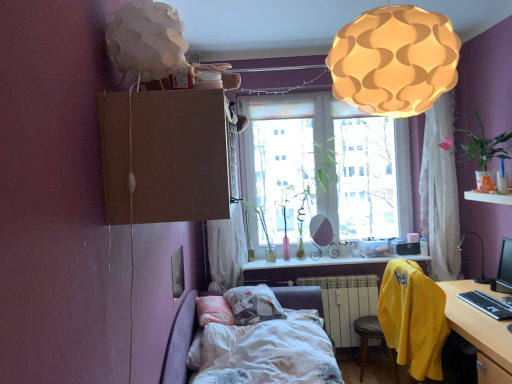
Question: Does white cotton bed at center come behind white sheer curtain at upper right, which appears as the 1th curtain when viewed from the right?

Choices:
 (A) yes
 (B) no

Answer: (B)

Question: Does white cotton bed at center turn towards white sheer curtain at upper right, which appears as the 1th curtain when viewed from the right?

Choices:
 (A) no
 (B) yes

Answer: (A)

Question: Is white sheer curtain at upper right, which appears as the 1th curtain when viewed from the right, surrounded by white cotton bed at center?

Choices:
 (A) yes
 (B) no

Answer: (B)

Question: Would you consider white cotton bed at center to be distant from white sheer curtain at upper right, positioned as the second curtain in left-to-right order?

Choices:
 (A) yes
 (B) no

Answer: (A)

Question: Is white cotton bed at center thinner than white sheer curtain at upper right, which appears as the 1th curtain when viewed from the right?

Choices:
 (A) yes
 (B) no

Answer: (B)

Question: Is point (483, 256) closer or farther from the camera than point (224, 246)?

Choices:
 (A) farther
 (B) closer

Answer: (B)

Question: Would you say black plastic table lamp at right is to the left or to the right of white sheer curtain at upper center, the second curtain when ordered from right to left, in the picture?

Choices:
 (A) right
 (B) left

Answer: (A)

Question: From a real-world perspective, is black plastic table lamp at right physically located above or below white sheer curtain at upper center, which is counted as the first curtain, starting from the left?

Choices:
 (A) above
 (B) below

Answer: (B)

Question: From the image's perspective, is black plastic table lamp at right above or below white sheer curtain at upper center, the second curtain when ordered from right to left?

Choices:
 (A) below
 (B) above

Answer: (A)

Question: In terms of size, does black glossy monitor at right appear bigger or smaller than translucent glass window at center?

Choices:
 (A) big
 (B) small

Answer: (B)

Question: In the image, is black glossy monitor at right positioned in front of or behind translucent glass window at center?

Choices:
 (A) front
 (B) behind

Answer: (A)

Question: From a real-world perspective, is black glossy monitor at right physically located above or below translucent glass window at center?

Choices:
 (A) below
 (B) above

Answer: (A)

Question: From the image's perspective, is black glossy monitor at right located above or below translucent glass window at center?

Choices:
 (A) above
 (B) below

Answer: (B)

Question: From the image's perspective, is wooden desk at lower right positioned above or below green leafy plant at upper right, the first plant when ordered from right to left?

Choices:
 (A) below
 (B) above

Answer: (A)

Question: Based on their positions, is wooden desk at lower right located to the left or right of green leafy plant at upper right, marked as the fourth plant in a back-to-front arrangement?

Choices:
 (A) right
 (B) left

Answer: (B)